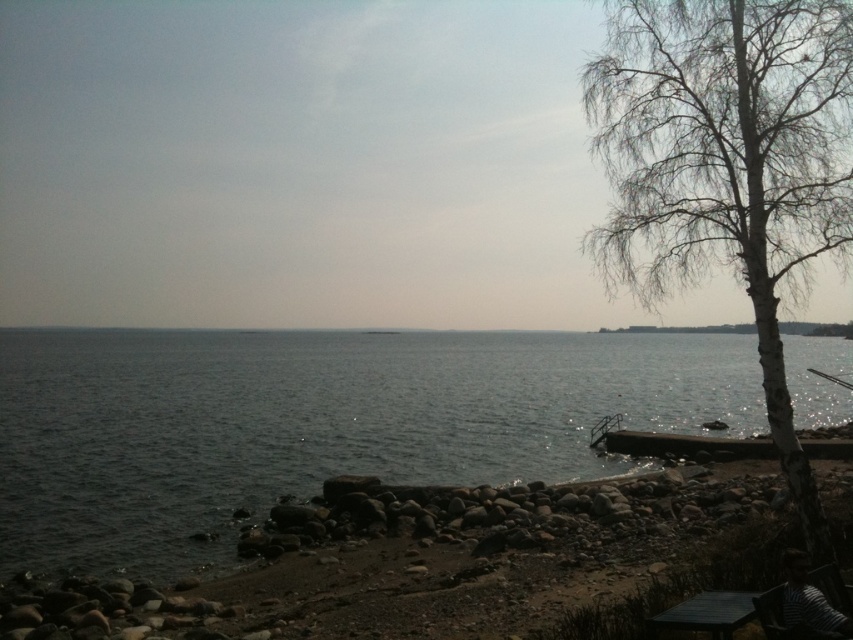
Question: Which point is farther to the camera?

Choices:
 (A) (787, 433)
 (B) (737, 374)

Answer: (B)

Question: Which point is farther to the camera?

Choices:
 (A) (347, 416)
 (B) (828, 204)

Answer: (A)

Question: Is the position of dark gray water at center more distant than that of white bark tree at right?

Choices:
 (A) no
 (B) yes

Answer: (B)

Question: Does dark gray water at center come behind white bark tree at right?

Choices:
 (A) yes
 (B) no

Answer: (A)

Question: Does dark gray water at center have a smaller size compared to white bark tree at right?

Choices:
 (A) yes
 (B) no

Answer: (B)

Question: Which object is closer to the camera taking this photo?

Choices:
 (A) dark gray water at center
 (B) white bark tree at right

Answer: (B)